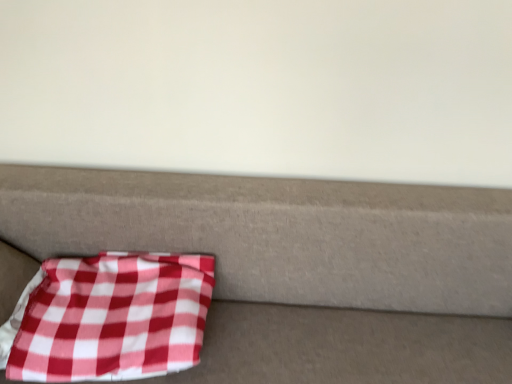
In order to click on red checkered fabric at lower left in this screenshot , I will do `click(109, 318)`.

The image size is (512, 384). Describe the element at coordinates (109, 318) in the screenshot. I see `red checkered fabric at lower left` at that location.

What do you see at coordinates (301, 267) in the screenshot? I see `red checkered fabric at lower left` at bounding box center [301, 267].

I want to click on red checkered fabric at lower left, so click(301, 267).

Where is `red checkered fabric at lower left`? This screenshot has height=384, width=512. red checkered fabric at lower left is located at coordinates (109, 318).

Can you confirm if red checkered fabric at lower left is positioned to the left of red checkered fabric at lower left?

Correct, you'll find red checkered fabric at lower left to the left of red checkered fabric at lower left.

Consider the image. Is red checkered fabric at lower left further to camera compared to red checkered fabric at lower left?

That is True.

Which is farther from the camera, (134, 297) or (365, 194)?

Positioned behind is point (365, 194).

From the image's perspective, which is above, red checkered fabric at lower left or red checkered fabric at lower left?

red checkered fabric at lower left appears higher in the image.

From a real-world perspective, is red checkered fabric at lower left positioned under red checkered fabric at lower left based on gravity?

Actually, red checkered fabric at lower left is physically above red checkered fabric at lower left in the real world.

Which object is wider, red checkered fabric at lower left or red checkered fabric at lower left?

red checkered fabric at lower left is wider.

Does red checkered fabric at lower left have a greater height compared to red checkered fabric at lower left?

In fact, red checkered fabric at lower left may be shorter than red checkered fabric at lower left.

Can you confirm if red checkered fabric at lower left is bigger than red checkered fabric at lower left?

No, red checkered fabric at lower left is not bigger than red checkered fabric at lower left.

Do you think red checkered fabric at lower left is within red checkered fabric at lower left, or outside of it?

red checkered fabric at lower left is enclosed within red checkered fabric at lower left.

Would you say red checkered fabric at lower left is a long distance from red checkered fabric at lower left?

No.

Is red checkered fabric at lower left at the back of red checkered fabric at lower left?

Yes, red checkered fabric at lower left is positioned with its back facing red checkered fabric at lower left.

How many degrees apart are the facing directions of red checkered fabric at lower left and red checkered fabric at lower left?

There is a 9.84e-05-degree angle between the facing directions of red checkered fabric at lower left and red checkered fabric at lower left.

The height and width of the screenshot is (384, 512). Find the location of `furniture in front of the red checkered fabric at lower left`. furniture in front of the red checkered fabric at lower left is located at coordinates (301, 267).

Considering the positions of objects red checkered fabric at lower left and red checkered fabric at lower left in the image provided, who is more to the left, red checkered fabric at lower left or red checkered fabric at lower left?

red checkered fabric at lower left.

In the scene shown: Is red checkered fabric at lower left closer to camera compared to red checkered fabric at lower left?

Yes.

Is point (501, 232) positioned after point (19, 363)?

Yes, it is.

From the image's perspective, between red checkered fabric at lower left and red checkered fabric at lower left, who is located below?

From the image's view, red checkered fabric at lower left is below.

Consider the image. From a real-world perspective, is red checkered fabric at lower left over red checkered fabric at lower left?

No, from a real-world perspective, red checkered fabric at lower left is not on top of red checkered fabric at lower left.

Looking at their sizes, would you say red checkered fabric at lower left is wider or thinner than red checkered fabric at lower left?

→ Considering their sizes, red checkered fabric at lower left looks broader than red checkered fabric at lower left.

Between red checkered fabric at lower left and red checkered fabric at lower left, which one has more height?

red checkered fabric at lower left.

Considering the sizes of objects red checkered fabric at lower left and red checkered fabric at lower left in the image provided, who is smaller, red checkered fabric at lower left or red checkered fabric at lower left?

With smaller size is red checkered fabric at lower left.

Would you say red checkered fabric at lower left contains red checkered fabric at lower left?

Yes, red checkered fabric at lower left is surrounding red checkered fabric at lower left.

Based on the photo, does red checkered fabric at lower left touch red checkered fabric at lower left?

No.

Is red checkered fabric at lower left turned away from red checkered fabric at lower left?

Yes, red checkered fabric at lower left is at the back of red checkered fabric at lower left.

This screenshot has height=384, width=512. In the image, there is a red checkered fabric at lower left. In order to click on furniture below it (from a real-world perspective) in this screenshot , I will do `click(301, 267)`.

Identify the location of blanket above the red checkered fabric at lower left (from the image's perspective). (109, 318).

Where is `blanket above the red checkered fabric at lower left (from a real-world perspective)`? blanket above the red checkered fabric at lower left (from a real-world perspective) is located at coordinates (109, 318).